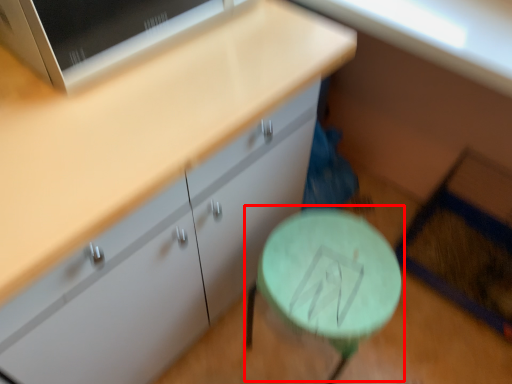
Question: From the image's perspective, where is round table (annotated by the red box) located in relation to cabinetry in the image?

Choices:
 (A) below
 (B) above

Answer: (A)